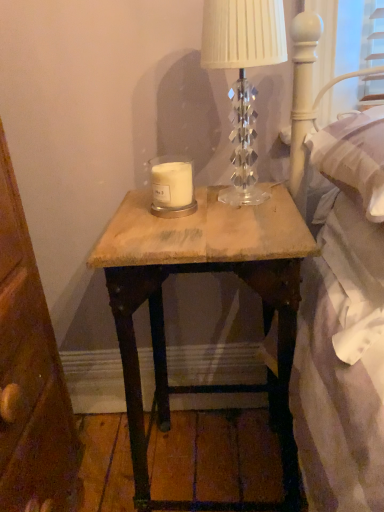
Question: Is clear crystal lamp at upper center wider than wooden nightstand at center?

Choices:
 (A) no
 (B) yes

Answer: (A)

Question: Is clear crystal lamp at upper center next to wooden nightstand at center?

Choices:
 (A) no
 (B) yes

Answer: (A)

Question: Considering the relative sizes of clear crystal lamp at upper center and wooden nightstand at center in the image provided, is clear crystal lamp at upper center shorter than wooden nightstand at center?

Choices:
 (A) yes
 (B) no

Answer: (A)

Question: Does clear crystal lamp at upper center appear on the right side of wooden nightstand at center?

Choices:
 (A) no
 (B) yes

Answer: (B)

Question: Considering the relative sizes of clear crystal lamp at upper center and wooden nightstand at center in the image provided, is clear crystal lamp at upper center thinner than wooden nightstand at center?

Choices:
 (A) no
 (B) yes

Answer: (B)

Question: Is clear crystal lamp at upper center aimed at wooden nightstand at center?

Choices:
 (A) yes
 (B) no

Answer: (B)

Question: Can you confirm if white matte candle at center is smaller than clear crystal lamp at upper center?

Choices:
 (A) yes
 (B) no

Answer: (A)

Question: Is white matte candle at center outside clear crystal lamp at upper center?

Choices:
 (A) yes
 (B) no

Answer: (A)

Question: Is the position of white matte candle at center less distant than that of clear crystal lamp at upper center?

Choices:
 (A) yes
 (B) no

Answer: (B)

Question: From a real-world perspective, is white matte candle at center on top of clear crystal lamp at upper center?

Choices:
 (A) yes
 (B) no

Answer: (B)

Question: Considering the relative positions of white matte candle at center and clear crystal lamp at upper center in the image provided, is white matte candle at center to the right of clear crystal lamp at upper center from the viewer's perspective?

Choices:
 (A) yes
 (B) no

Answer: (B)

Question: Considering the relative sizes of white matte candle at center and clear crystal lamp at upper center in the image provided, is white matte candle at center taller than clear crystal lamp at upper center?

Choices:
 (A) no
 (B) yes

Answer: (A)

Question: Considering the relative sizes of clear crystal lamp at upper center and white matte candle at center in the image provided, is clear crystal lamp at upper center taller than white matte candle at center?

Choices:
 (A) no
 (B) yes

Answer: (B)